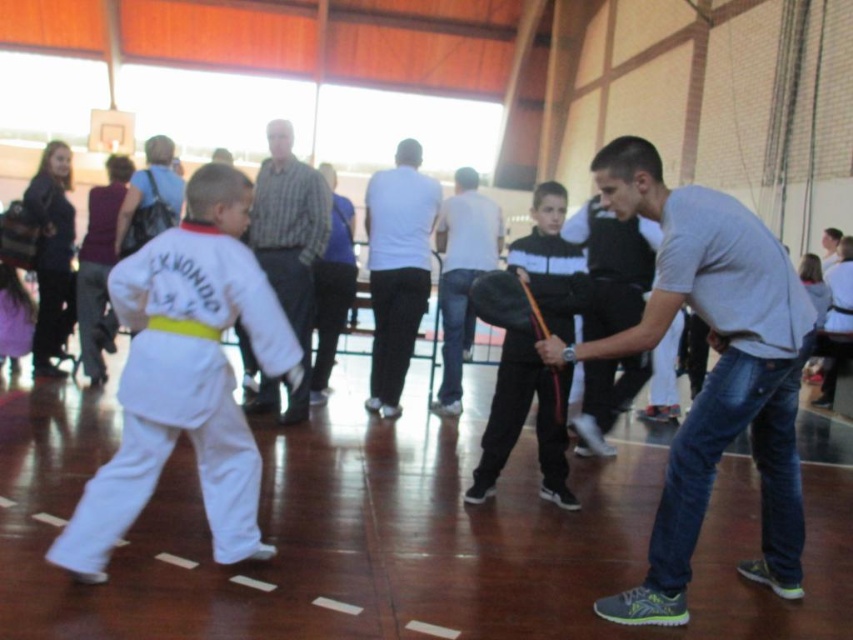
Between point (682, 444) and point (306, 179), which one is positioned in front?

Point (682, 444) is more forward.

Does gray cotton t-shirt at center have a smaller size compared to striped cotton shirt at center?

No, gray cotton t-shirt at center is not smaller than striped cotton shirt at center.

I want to click on gray cotton t-shirt at center, so click(711, 372).

Between white matte karate uniform at left and light gray shirt at center, which one is positioned lower?

white matte karate uniform at left

Which is more to the left, white matte karate uniform at left or light gray shirt at center?

white matte karate uniform at left is more to the left.

The width and height of the screenshot is (853, 640). Find the location of `white matte karate uniform at left`. white matte karate uniform at left is located at coordinates (186, 378).

Does black matte jacket at center have a lesser width compared to white matte shirt at center?

Incorrect, black matte jacket at center's width is not less than white matte shirt at center's.

Between black matte jacket at center and white matte shirt at center, which one appears on the right side from the viewer's perspective?

From the viewer's perspective, black matte jacket at center appears more on the right side.

Which is behind, point (515, 352) or point (410, 349)?

Point (410, 349)

At what (x,y) coordinates should I click in order to perform the action: click on black matte jacket at center. Please return your answer as a coordinate pair (x, y). Looking at the image, I should click on (523, 420).